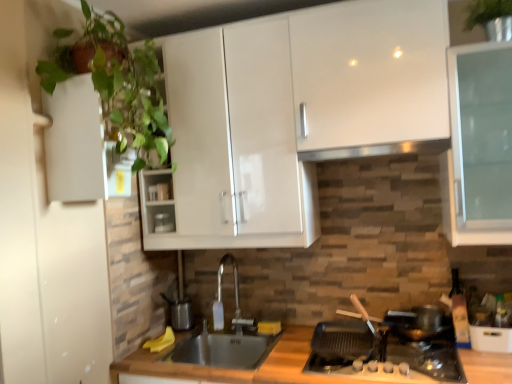
Question: Considering the positions of black glass gas stove at lower right and black stainless steel sink at center in the image, is black glass gas stove at lower right bigger or smaller than black stainless steel sink at center?

Choices:
 (A) big
 (B) small

Answer: (B)

Question: Is black glass gas stove at lower right in front of or behind black stainless steel sink at center in the image?

Choices:
 (A) front
 (B) behind

Answer: (A)

Question: Which object is positioned farthest from the green leafy plant at left?

Choices:
 (A) matte white container at center
 (B) black glass gas stove at lower right
 (C) black stainless steel sink at center
 (D) stainless steel exhaust hood at upper center

Answer: (B)

Question: Which is nearer to the stainless steel exhaust hood at upper center?

Choices:
 (A) black stainless steel sink at center
 (B) green leafy plant at left
 (C) matte white container at center
 (D) black glass gas stove at lower right

Answer: (B)